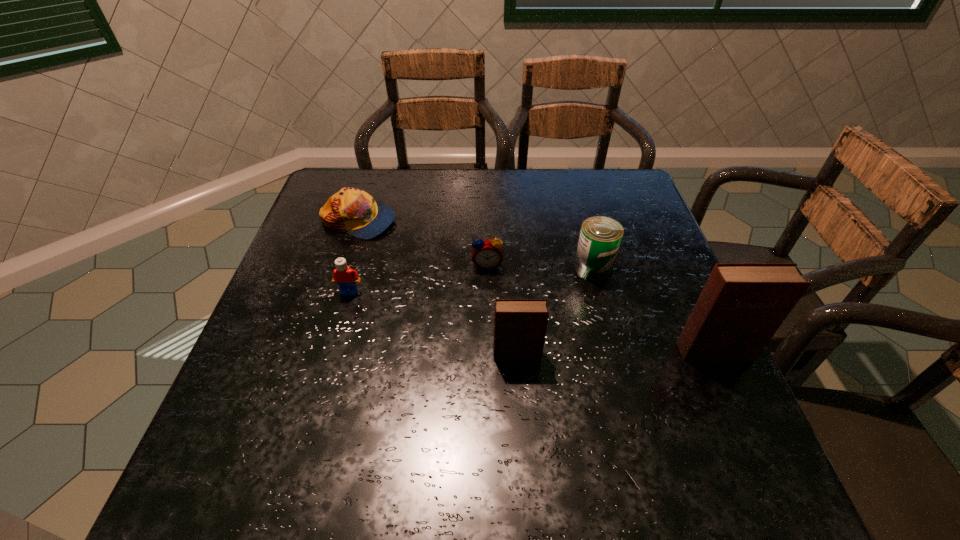
I want to click on the left diary, so click(520, 325).

Identify the location of the shorter diary. (520, 325).

Locate an element on the screen. This screenshot has height=540, width=960. the right diary is located at coordinates coord(742,305).

This screenshot has height=540, width=960. Find the location of `the tallest object`. the tallest object is located at coordinates (742, 305).

Locate an element on the screen. The height and width of the screenshot is (540, 960). Lego is located at coordinates coord(343,275).

Locate an element on the screen. alarm clock is located at coordinates (487, 254).

Locate an element on the screen. The height and width of the screenshot is (540, 960). the shortest object is located at coordinates (354, 211).

The width and height of the screenshot is (960, 540). In order to click on cap in this screenshot , I will do `click(354, 211)`.

I want to click on the fourth shortest object, so click(600, 237).

The width and height of the screenshot is (960, 540). Identify the location of can. point(600,237).